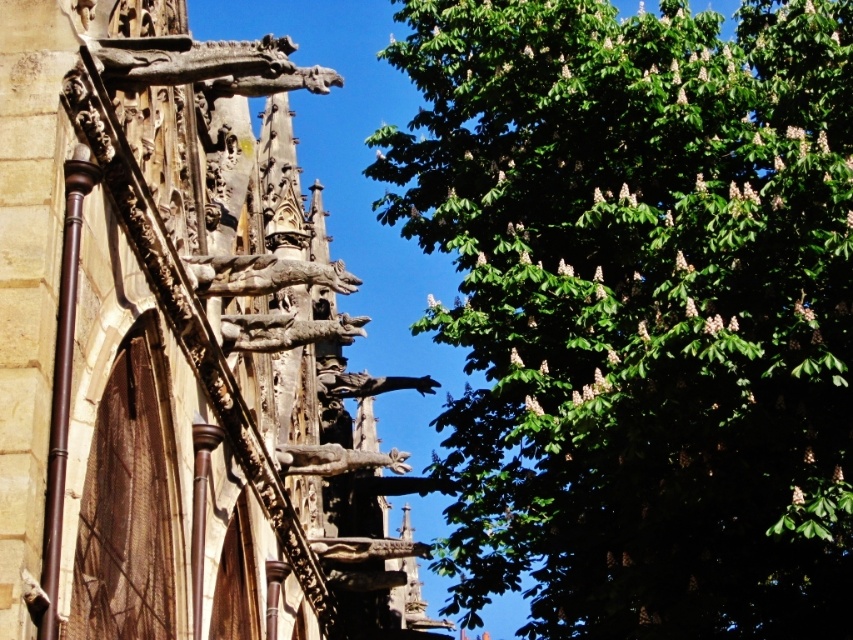
You are standing in front of the Gothic building and the tree. There are two points marked on the image, one at coordinates point (305, 326) and another at point (305, 465). If you were to walk towards the tree, which point would you encounter first?

Point (305, 326) is closer to the camera than point (305, 465). Therefore, when walking towards the tree, you would encounter point (305, 326) first.

You are an architect analyzing the image. You need to determine which object occupies more horizontal space in the composition. Based on the scene, which one is wider between the green leafy tree at upper right and the bronze statue at center?

The green leafy tree at upper right is wider than the bronze statue at center according to the description.

You are standing in front of the building with the Gothic architecture and the tree with flowers. You notice two points marked in the scene. The first point is at coordinate point (796,124) and the second is at point (231,316). Which point is closer to you?

Point (796,124) is further to the camera than point (231,316), so the second point is closer to you.